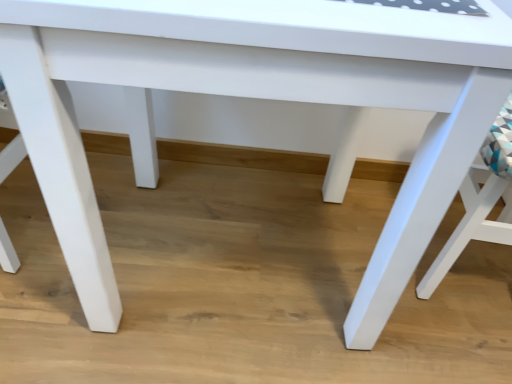
The width and height of the screenshot is (512, 384). What do you see at coordinates (477, 204) in the screenshot? I see `white glossy swivel chair at lower right` at bounding box center [477, 204].

What are the coordinates of `white glossy swivel chair at lower right` in the screenshot? It's located at (477, 204).

Image resolution: width=512 pixels, height=384 pixels. I want to click on white glossy swivel chair at lower right, so click(x=477, y=204).